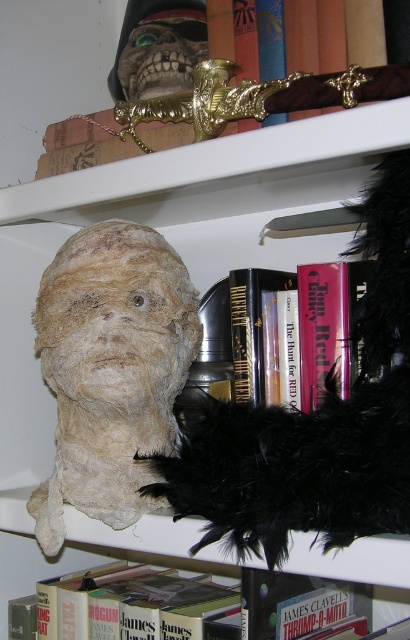
Question: Observing the image, what is the correct spatial positioning of white fabric mummy head at left in reference to hardcover book at center?

Choices:
 (A) above
 (B) below

Answer: (B)

Question: Which of the following is the closest to the observer?

Choices:
 (A) (186, 588)
 (B) (339, 328)

Answer: (B)

Question: Which of the following is the farthest from the observer?

Choices:
 (A) hardcover book at center
 (B) hardcover book at lower center

Answer: (B)

Question: Is white fabric mummy head at left below hardcover book at lower center?

Choices:
 (A) no
 (B) yes

Answer: (A)

Question: Which of the following is the farthest from the observer?

Choices:
 (A) (150, 566)
 (B) (41, 524)
 (C) (341, 365)

Answer: (A)

Question: Can you confirm if white fabric mummy head at left is positioned below hardcover book at lower center?

Choices:
 (A) no
 (B) yes

Answer: (A)